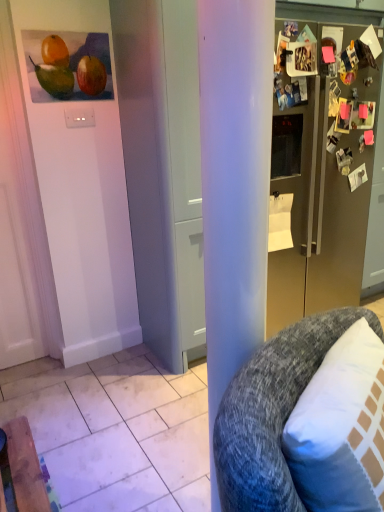
Question: Is matte orange at upper left placed right next to satin gold refrigerator at right?

Choices:
 (A) no
 (B) yes

Answer: (A)

Question: From a real-world perspective, is matte orange at upper left under satin gold refrigerator at right?

Choices:
 (A) no
 (B) yes

Answer: (A)

Question: Considering the relative sizes of matte orange at upper left and satin gold refrigerator at right in the image provided, is matte orange at upper left smaller than satin gold refrigerator at right?

Choices:
 (A) yes
 (B) no

Answer: (A)

Question: Considering the relative sizes of matte orange at upper left and satin gold refrigerator at right in the image provided, is matte orange at upper left bigger than satin gold refrigerator at right?

Choices:
 (A) yes
 (B) no

Answer: (B)

Question: Can you confirm if matte orange at upper left is thinner than satin gold refrigerator at right?

Choices:
 (A) yes
 (B) no

Answer: (A)

Question: From a real-world perspective, relative to gray textured cushion at right, is matte orange at upper left vertically above or below?

Choices:
 (A) below
 (B) above

Answer: (B)

Question: Considering the positions of matte orange at upper left and gray textured cushion at right in the image, is matte orange at upper left taller or shorter than gray textured cushion at right?

Choices:
 (A) short
 (B) tall

Answer: (A)

Question: Considering the positions of matte orange at upper left and gray textured cushion at right in the image, is matte orange at upper left bigger or smaller than gray textured cushion at right?

Choices:
 (A) big
 (B) small

Answer: (B)

Question: Does point (109, 74) appear closer or farther from the camera than point (264, 488)?

Choices:
 (A) closer
 (B) farther

Answer: (B)

Question: From a real-world perspective, relative to white matte door at center, is matte orange at upper left vertically above or below?

Choices:
 (A) above
 (B) below

Answer: (A)

Question: In the image, is matte orange at upper left positioned in front of or behind white matte door at center?

Choices:
 (A) front
 (B) behind

Answer: (B)

Question: Considering the positions of point (82, 68) and point (175, 120), is point (82, 68) closer or farther from the camera than point (175, 120)?

Choices:
 (A) farther
 (B) closer

Answer: (A)

Question: Considering the positions of matte orange at upper left and white matte door at center in the image, is matte orange at upper left wider or thinner than white matte door at center?

Choices:
 (A) wide
 (B) thin

Answer: (B)

Question: Is point (180, 109) positioned closer to the camera than point (86, 95)?

Choices:
 (A) farther
 (B) closer

Answer: (B)

Question: Do you think white matte door at center is within matte orange at upper left, or outside of it?

Choices:
 (A) inside
 (B) outside

Answer: (B)